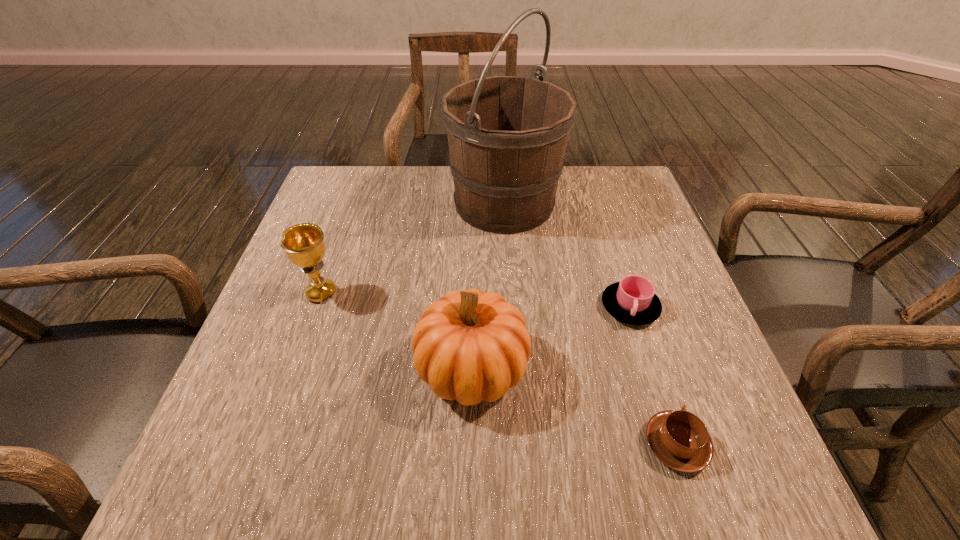
Locate an element on the screen. The width and height of the screenshot is (960, 540). vacant space situated 0.300m on the side with the handle of the cup is located at coordinates point(687,488).

This screenshot has width=960, height=540. Identify the location of vacant space located 0.210m on the side of the cappuccino with the handle. (636, 319).

In order to click on vacant region located 0.380m on the side of the cappuccino with the handle in this screenshot , I will do `click(617, 262)`.

The width and height of the screenshot is (960, 540). In order to click on vacant space located 0.370m on the side of the cappuccino with the handle in this screenshot , I will do `click(618, 265)`.

The width and height of the screenshot is (960, 540). What are the coordinates of `object situated at the far edge` in the screenshot? It's located at (507, 135).

You are a GUI agent. You are given a task and a screenshot of the screen. Output one action in this format:
    pyautogui.click(x=<x>, y=<y>)
    Task: Click on the object located in the near edge section of the desktop
    
    Given the screenshot: What is the action you would take?
    (679, 439)

At what (x,y) coordinates should I click in order to perform the action: click on object situated at the left edge. Please return your answer as a coordinate pair (x, y). This screenshot has width=960, height=540. Looking at the image, I should click on (304, 245).

Locate an element on the screen. The image size is (960, 540). cup present at the right edge is located at coordinates (633, 300).

Identify the location of cappuccino at the right edge. Image resolution: width=960 pixels, height=540 pixels. (679, 439).

The height and width of the screenshot is (540, 960). I want to click on object located at the near right corner, so click(679, 439).